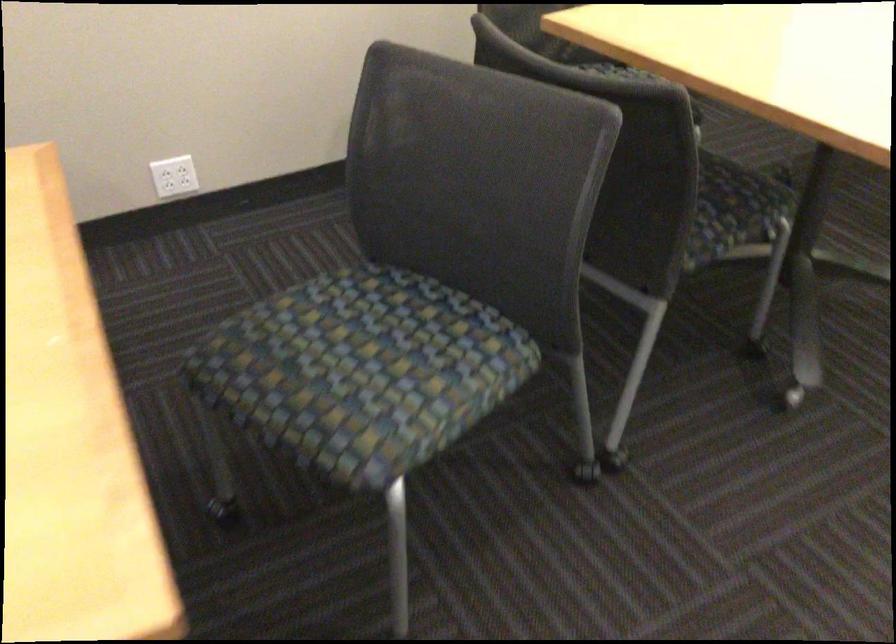
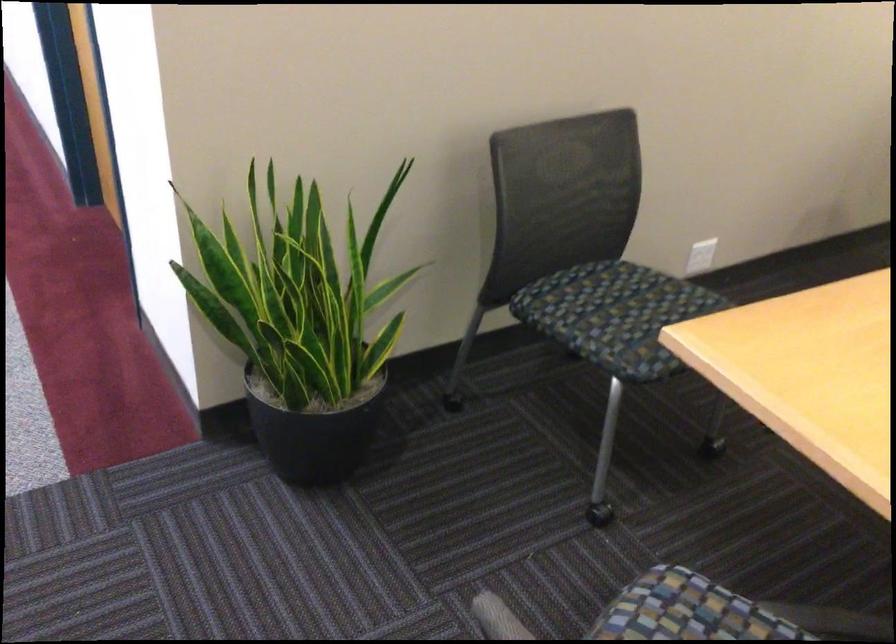
Question: What movement of the cameraman would produce the second image?

Choices:
 (A) Left
 (B) Right
 (C) Forward
 (D) Backward

Answer: (A)